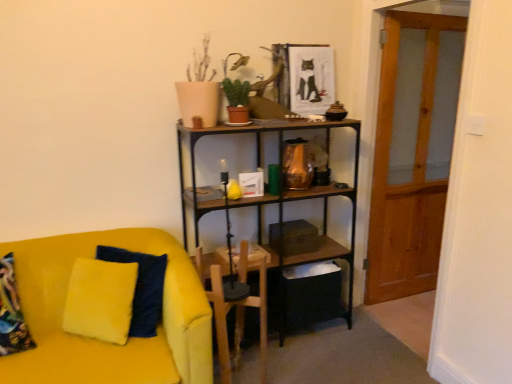
Question: Should I look upward or downward to see green matte plant at upper center?

Choices:
 (A) down
 (B) up

Answer: (B)

Question: From a real-world perspective, is wooden armchair at center over velvet yellow couch at left?

Choices:
 (A) yes
 (B) no

Answer: (A)

Question: Is wooden armchair at center smaller than velvet yellow couch at left?

Choices:
 (A) yes
 (B) no

Answer: (A)

Question: Is velvet yellow couch at left inside wooden armchair at center?

Choices:
 (A) yes
 (B) no

Answer: (B)

Question: From a real-world perspective, is wooden armchair at center physically below velvet yellow couch at left?

Choices:
 (A) yes
 (B) no

Answer: (B)

Question: From the image's perspective, does wooden armchair at center appear lower than velvet yellow couch at left?

Choices:
 (A) no
 (B) yes

Answer: (A)

Question: Is wooden armchair at center in front of velvet yellow couch at left?

Choices:
 (A) no
 (B) yes

Answer: (A)

Question: From the image's perspective, is velvet yellow couch at left located above wooden armchair at center?

Choices:
 (A) yes
 (B) no

Answer: (B)

Question: Is the depth of velvet yellow couch at left greater than that of wooden armchair at center?

Choices:
 (A) yes
 (B) no

Answer: (B)

Question: Is velvet yellow couch at left completely or partially outside of wooden armchair at center?

Choices:
 (A) yes
 (B) no

Answer: (A)

Question: From a real-world perspective, is velvet yellow couch at left physically below wooden armchair at center?

Choices:
 (A) no
 (B) yes

Answer: (B)

Question: Considering the relative sizes of velvet yellow couch at left and wooden armchair at center in the image provided, is velvet yellow couch at left shorter than wooden armchair at center?

Choices:
 (A) no
 (B) yes

Answer: (A)

Question: Can you confirm if velvet yellow couch at left is positioned to the right of wooden armchair at center?

Choices:
 (A) yes
 (B) no

Answer: (B)

Question: Does wooden armchair at center appear on the right side of transparent wooden door at right?

Choices:
 (A) yes
 (B) no

Answer: (B)